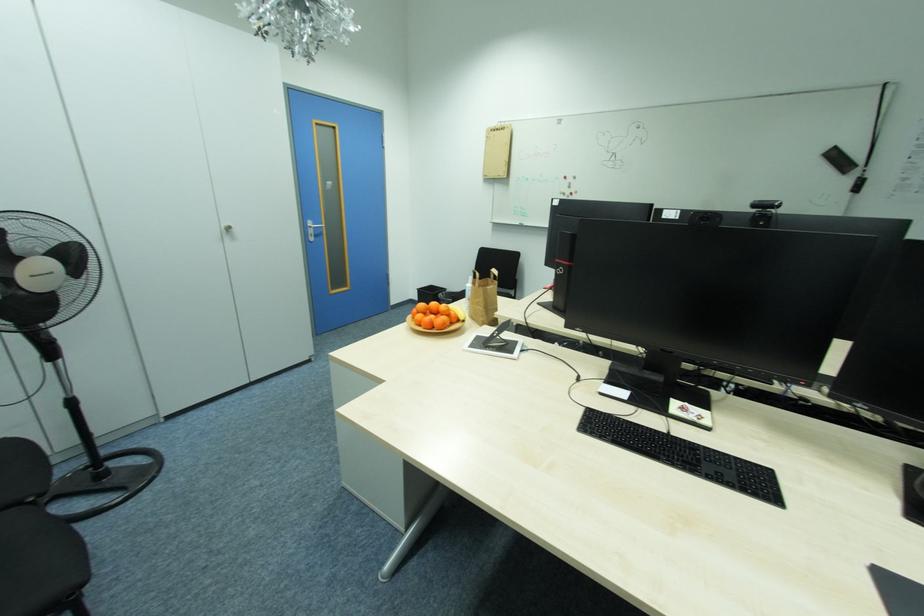
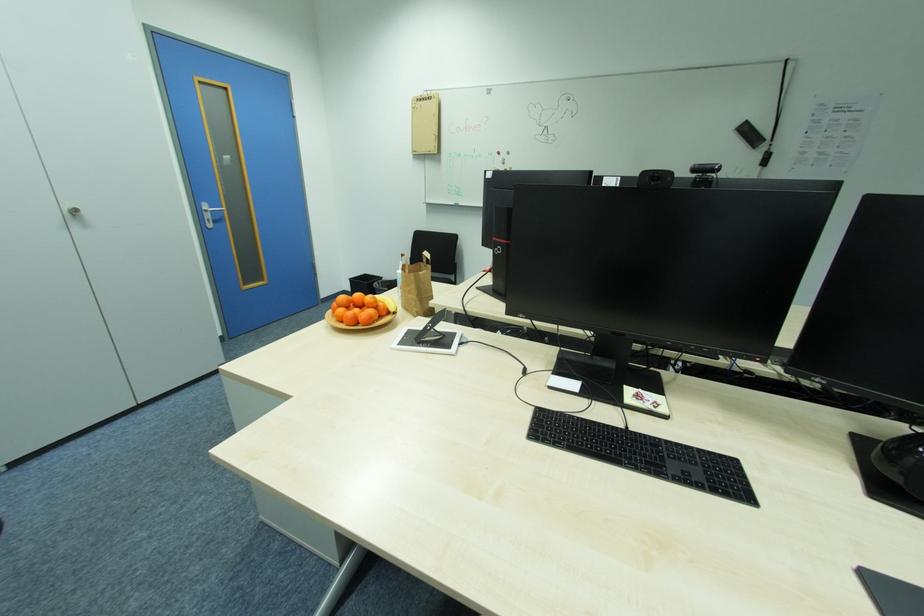
Question: The first image is from the beginning of the video and the second image is from the end. How did the camera likely rotate when shooting the video?

Choices:
 (A) Left
 (B) Right
 (C) Up
 (D) Down

Answer: (B)